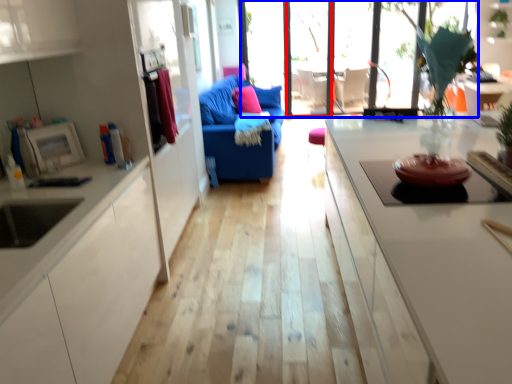
Question: Which point is closer to the camera, glass door (highlighted by a red box) or window (highlighted by a blue box)?

Choices:
 (A) glass door
 (B) window

Answer: (B)